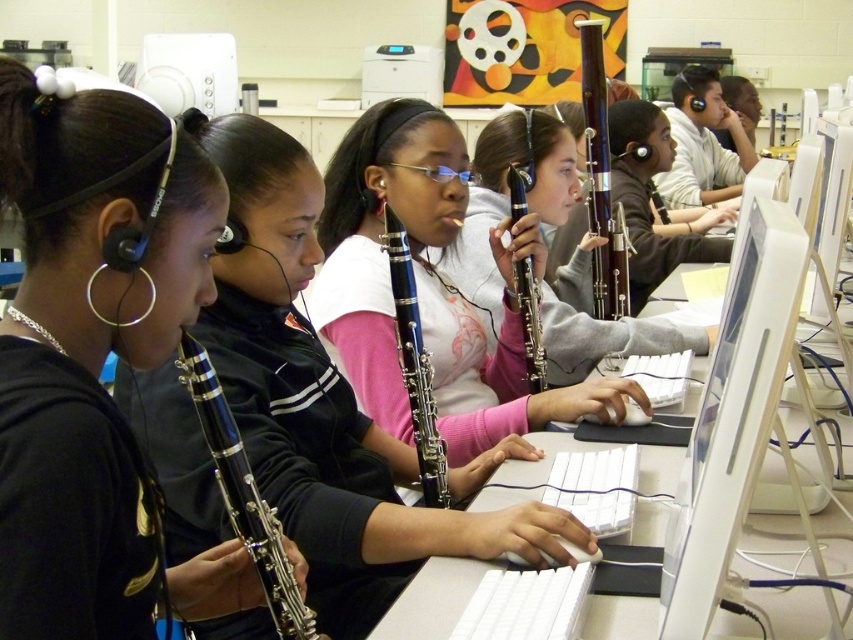
Does black glossy clarinet at center lie behind matte black clarinet at center?

No, black glossy clarinet at center is in front of matte black clarinet at center.

Does point (263, 499) come behind point (543, 355)?

That is False.

I want to click on black glossy clarinet at center, so click(x=244, y=496).

Between dark brown wood bassoon at center and matte black clarinet at center, which one has less height?

With less height is matte black clarinet at center.

Can you confirm if dark brown wood bassoon at center is positioned to the left of matte black clarinet at center?

In fact, dark brown wood bassoon at center is to the right of matte black clarinet at center.

What are the coordinates of `dark brown wood bassoon at center` in the screenshot? It's located at (601, 182).

Is black glossy clarinet at center taller than dark brown wood bassoon at center?

In fact, black glossy clarinet at center may be shorter than dark brown wood bassoon at center.

Is the position of black glossy clarinet at center more distant than that of dark brown wood bassoon at center?

No.

This screenshot has height=640, width=853. I want to click on black glossy clarinet at center, so click(x=244, y=496).

I want to click on black glossy clarinet at center, so click(x=244, y=496).